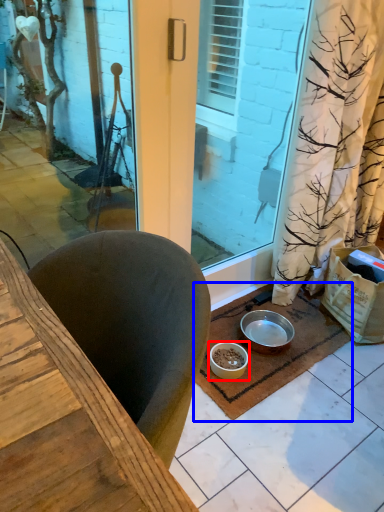
Question: Which object appears closest to the camera in this image, bowl (highlighted by a red box) or doormat (highlighted by a blue box)?

Choices:
 (A) bowl
 (B) doormat

Answer: (B)